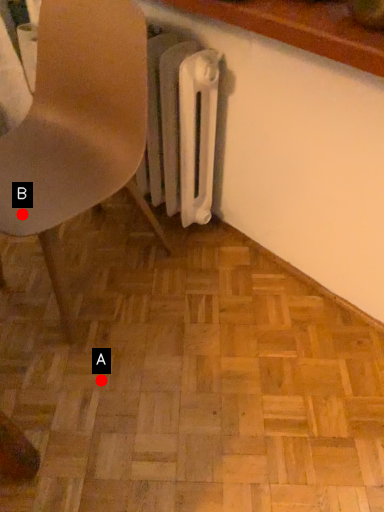
Question: Two points are circled on the image, labeled by A and B beside each circle. Among these points, which one is nearest to the camera?

Choices:
 (A) A is closer
 (B) B is closer

Answer: (B)